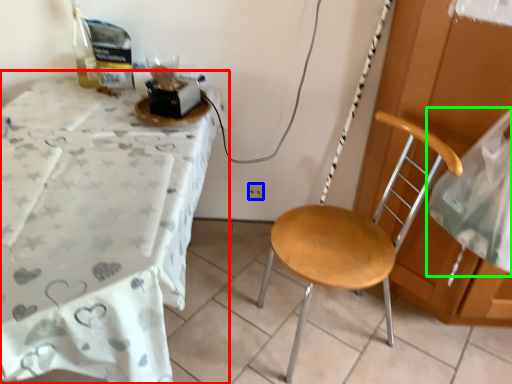
Question: Considering the real-world distances, which object is closest to desk (highlighted by a red box)? power outlet (highlighted by a blue box) or sheet (highlighted by a green box).

Choices:
 (A) power outlet
 (B) sheet

Answer: (A)